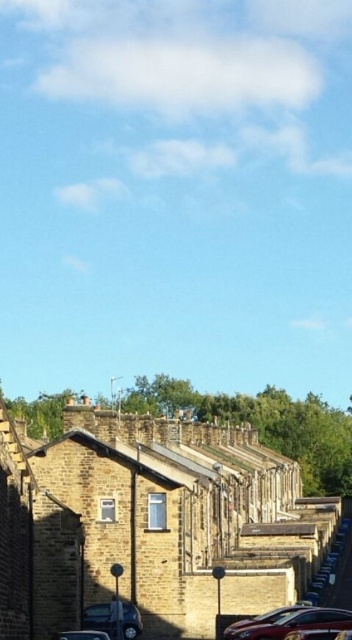
Question: Which object is positioned closest to the metallic silver car at lower center?

Choices:
 (A) metallic pole at center
 (B) shiny metallic car at lower center

Answer: (A)

Question: Which object is the closest to the shiny metallic car at lower center?

Choices:
 (A) metallic silver car at lower center
 (B) shiny black car at lower left
 (C) metallic pole at center

Answer: (C)

Question: Does shiny black car at lower left have a greater width compared to metallic pole at center?

Choices:
 (A) yes
 (B) no

Answer: (B)

Question: Can you confirm if metallic pole at center is positioned below shiny metallic car at lower center?

Choices:
 (A) yes
 (B) no

Answer: (B)

Question: Which point is closer to the camera taking this photo?

Choices:
 (A) (93, 634)
 (B) (275, 616)
 (C) (136, 614)

Answer: (A)

Question: Can you confirm if shiny black car at lower left is wider than metallic pole at center?

Choices:
 (A) yes
 (B) no

Answer: (B)